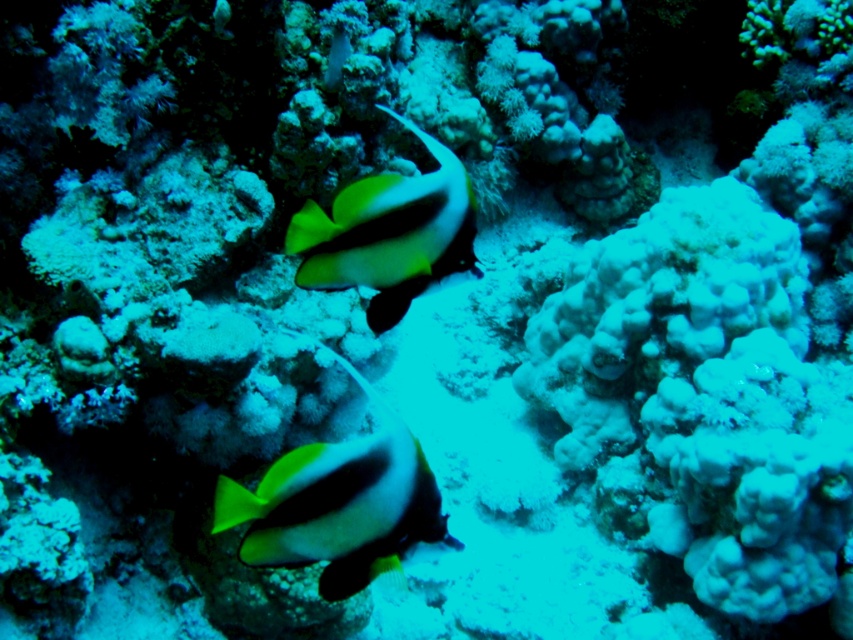
You are a marine biologist observing an underwater scene with a neon green matte fish at center and a black matte fish at center. Based on their positions, which fish is more likely to block the sunlight reaching the coral below them?

The neon green matte fish at center is more likely to block the sunlight because it is wider than the black matte fish at center, creating a larger shadow over the coral.

You are a marine biologist observing an underwater scene. You notice a neon green matte fish at center and a black matte fish at center. Which of these two fish is positioned to the left side of the other?

The neon green matte fish at center is positioned to the left of the black matte fish at center.